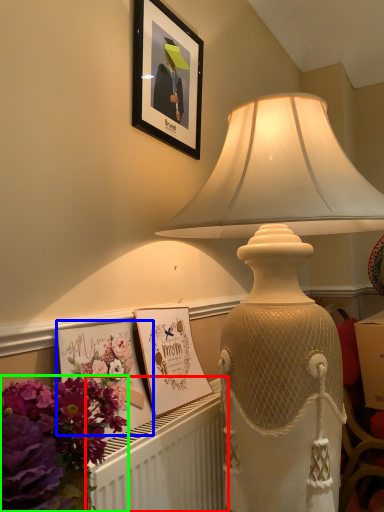
Question: Based on their relative distances, which object is nearer to radiator (highlighted by a red box)? Choose from postcard (highlighted by a blue box) and flower (highlighted by a green box).

Choices:
 (A) postcard
 (B) flower

Answer: (A)